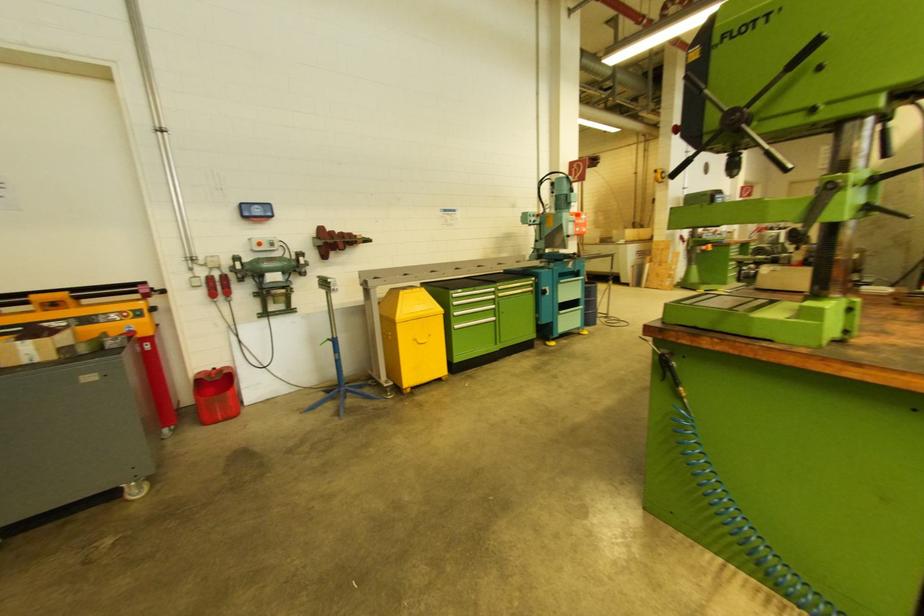
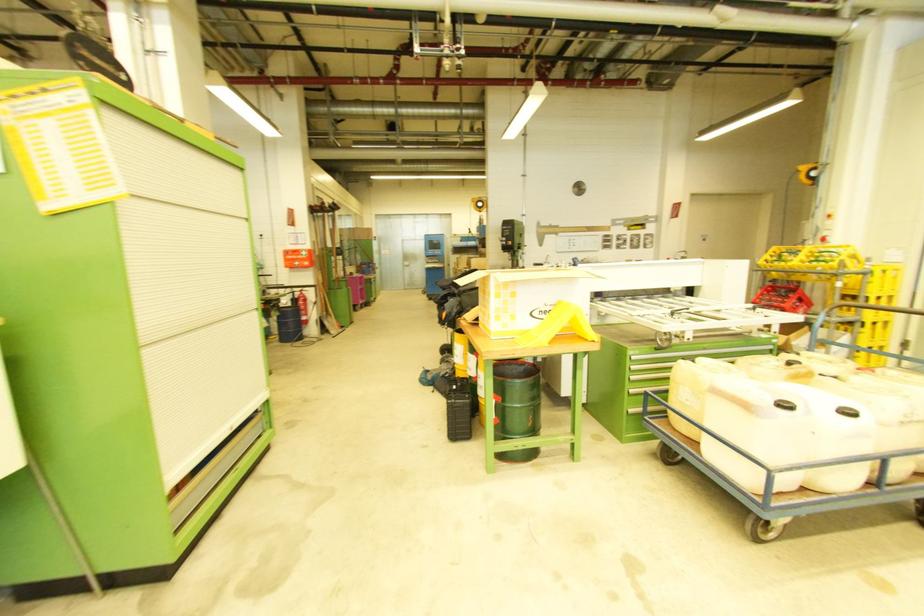
Question: I am providing you with two images of the same scene from different viewpoints. After the viewpoint changes to image2, which objects are now occluded?

Choices:
 (A) white container handle
 (B) green drawer handle
 (C) blue cabinet handle
 (D) red whiteboard eraser

Answer: (C)